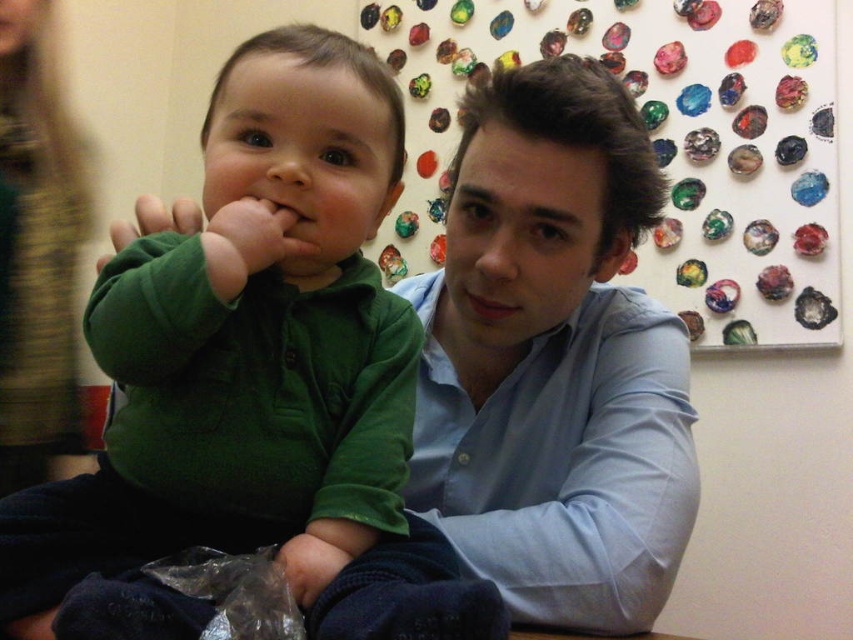
Question: Considering the real-world distances, which object is closest to the matte green sweater at center?

Choices:
 (A) green soft fabric at center
 (B) light blue shirt at center

Answer: (A)

Question: From the image, what is the correct spatial relationship of light blue shirt at center in relation to green soft fabric at center?

Choices:
 (A) above
 (B) below

Answer: (B)

Question: Which object appears closest to the camera in this image?

Choices:
 (A) green soft fabric at center
 (B) light blue shirt at center

Answer: (A)

Question: Which object appears closest to the camera in this image?

Choices:
 (A) matte green sweater at center
 (B) green soft fabric at center

Answer: (B)

Question: Is light blue shirt at center positioned behind green soft fabric at center?

Choices:
 (A) yes
 (B) no

Answer: (A)

Question: Can you confirm if green soft fabric at center is bigger than matte green sweater at center?

Choices:
 (A) no
 (B) yes

Answer: (B)